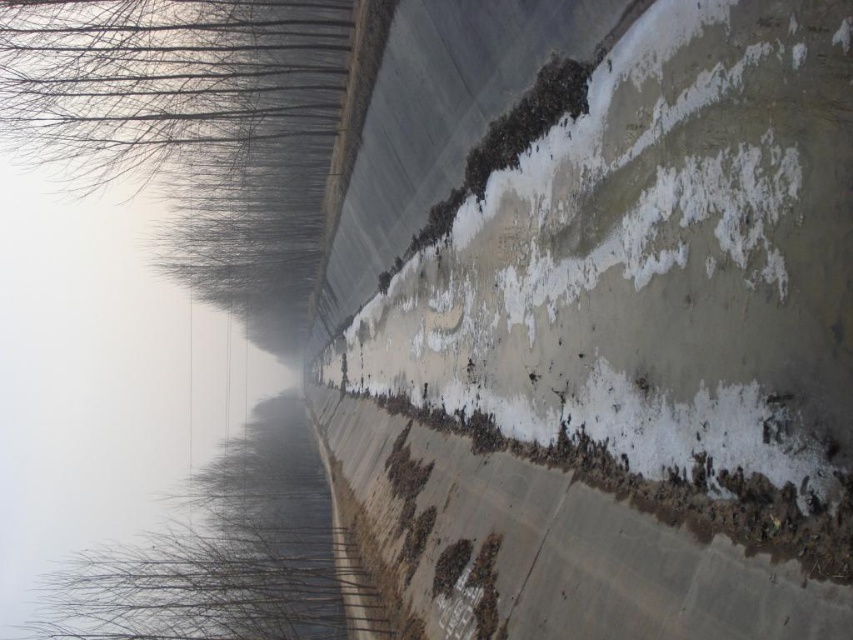
The height and width of the screenshot is (640, 853). I want to click on white rough concrete at center, so click(654, 259).

Who is higher up, white rough concrete at center or transparent water at upper left?

white rough concrete at center

Locate an element on the screen. white rough concrete at center is located at coordinates (654, 259).

The image size is (853, 640). Identify the location of white rough concrete at center. (654, 259).